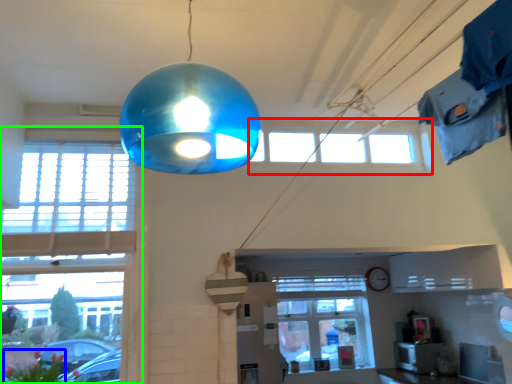
Question: Considering the real-world distances, which object is farthest from window (highlighted by a red box)? flower (highlighted by a blue box) or window (highlighted by a green box)?

Choices:
 (A) flower
 (B) window

Answer: (A)